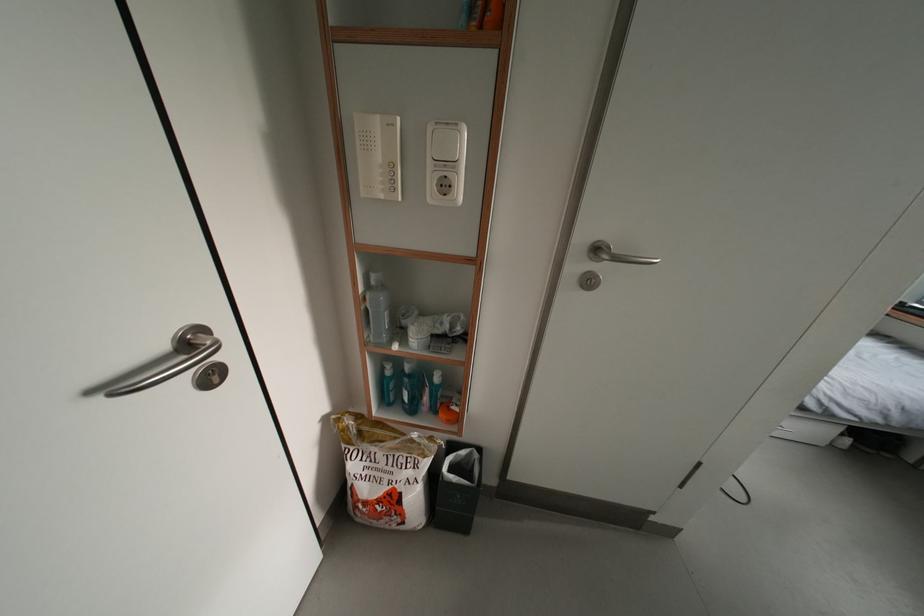
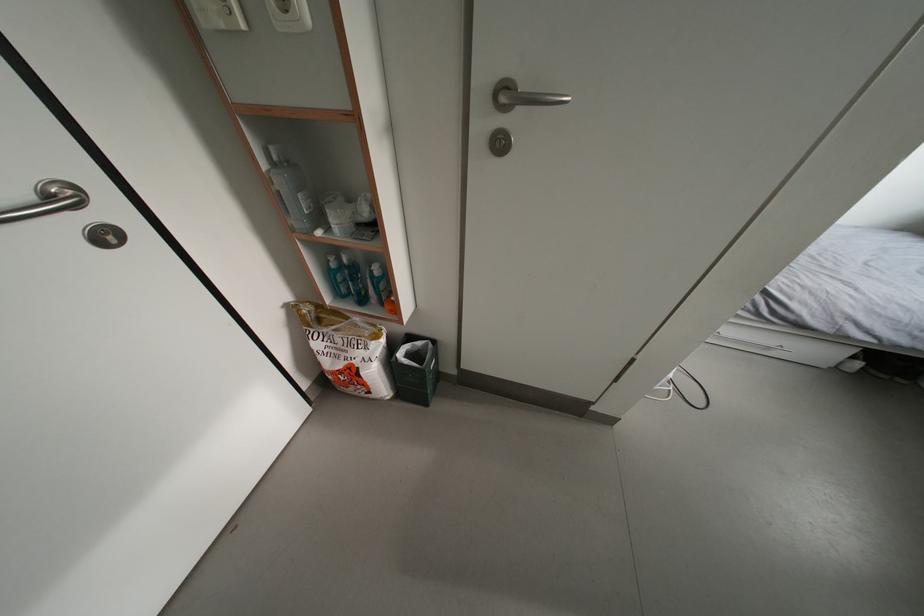
The point at (380, 288) is marked in the first image. Where is the corresponding point in the second image?

(283, 163)